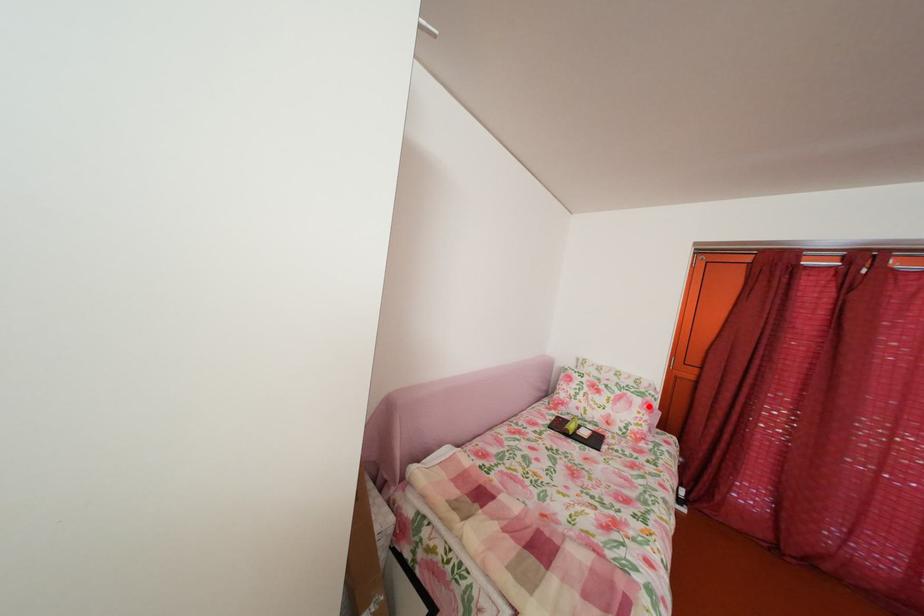
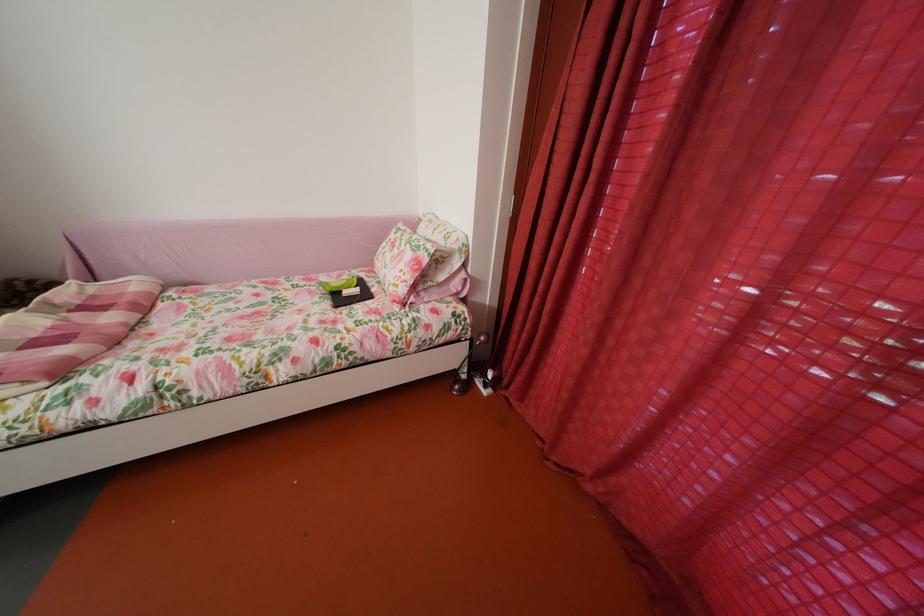
In the second image, find the point that corresponds to the highlighted location in the first image.

(419, 262)